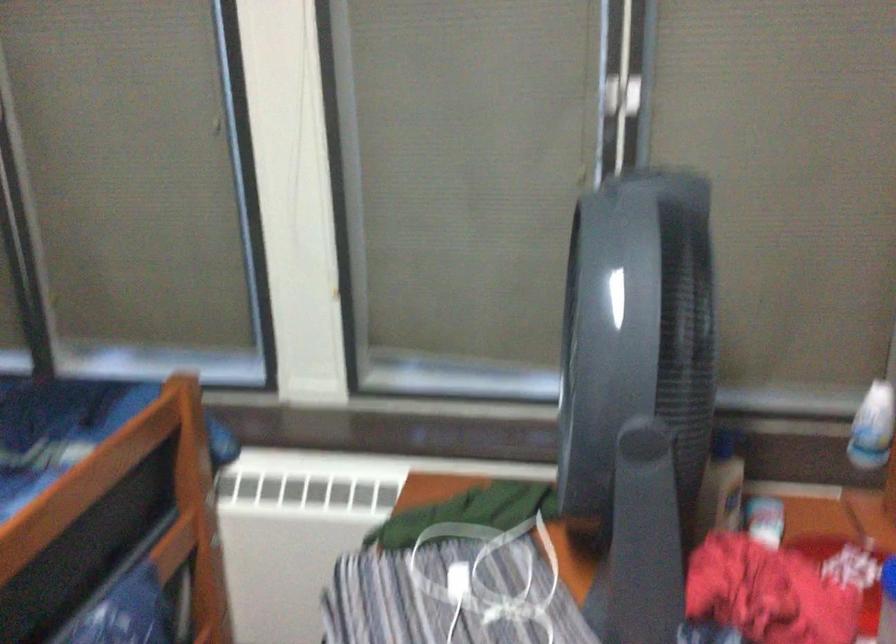
The width and height of the screenshot is (896, 644). Find the location of `white spray bottle`. white spray bottle is located at coordinates (872, 427).